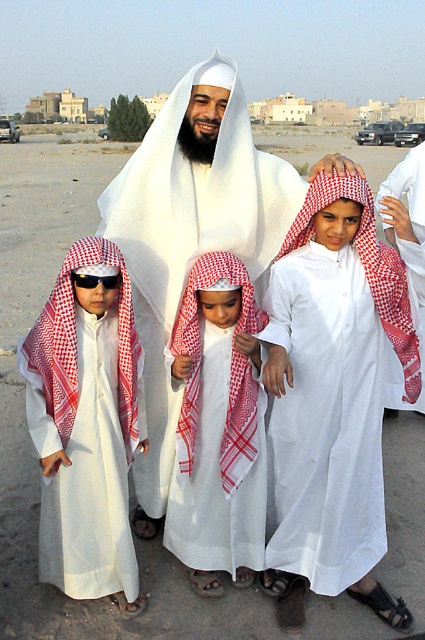
Can you confirm if white matte/soft cloth at center is taller than white checkered headscarf at center?

Yes, white matte/soft cloth at center is taller than white checkered headscarf at center.

Which of these two, white matte/soft cloth at center or white checkered headscarf at center, stands taller?

white matte/soft cloth at center

Image resolution: width=425 pixels, height=640 pixels. In order to click on white matte/soft cloth at center in this screenshot , I will do `click(190, 232)`.

Where is `white matte/soft cloth at center`? white matte/soft cloth at center is located at coordinates (190, 232).

Which is more to the left, white matte/soft cloth at center or white matte robe at left?

white matte robe at left is more to the left.

Is point (138, 468) less distant than point (62, 419)?

No, it is not.

You are a GUI agent. You are given a task and a screenshot of the screen. Output one action in this format:
    pyautogui.click(x=<x>, y=<y>)
    Task: Click on the white matte/soft cloth at center
    The height and width of the screenshot is (640, 425).
    Given the screenshot: What is the action you would take?
    pyautogui.click(x=190, y=232)

Does white matte robe at left have a lesser width compared to black plastic sunglasses at center?

In fact, white matte robe at left might be wider than black plastic sunglasses at center.

Describe the element at coordinates (87, 428) in the screenshot. The height and width of the screenshot is (640, 425). I see `white matte robe at left` at that location.

Locate an element on the screen. white matte robe at left is located at coordinates (87, 428).